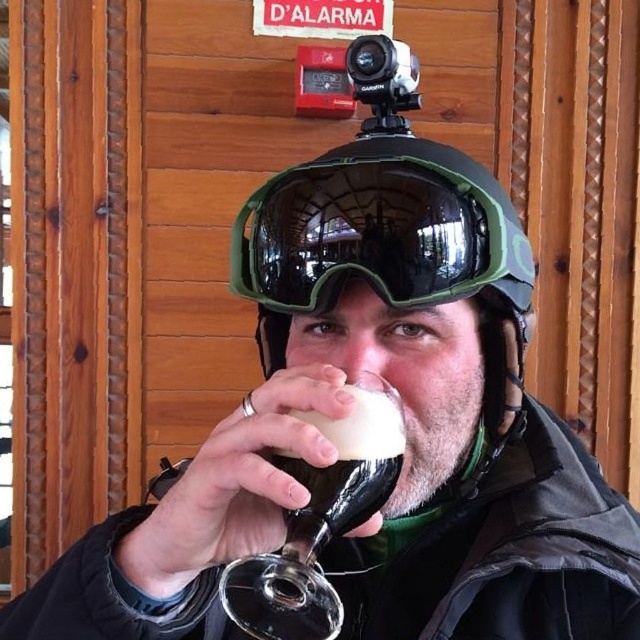
You are standing in a room with a person wearing winter gear and holding a drink. There is a red sign above their head and a point marked at coordinates (380,232). What object is located at that point?

The point at coordinates (380,232) corresponds to the green matte or glossy goggles at center.

From the picture: You are a delivery robot with a 6 inch wide arm. You need to place a package between the green matte helmet at center and the translucent glass wine glass at center. Can your arm fit between them?

The distance between the green matte helmet at center and the translucent glass wine glass at center is 5.20 inches. Since your arm is 6 inches wide, it cannot fit between them as the space is narrower than the arm.

You are trying to locate the green matte helmet at center in the scene. According to the coordinates provided, where exactly would you find it?

The green matte helmet at center is located at point (392, 241).